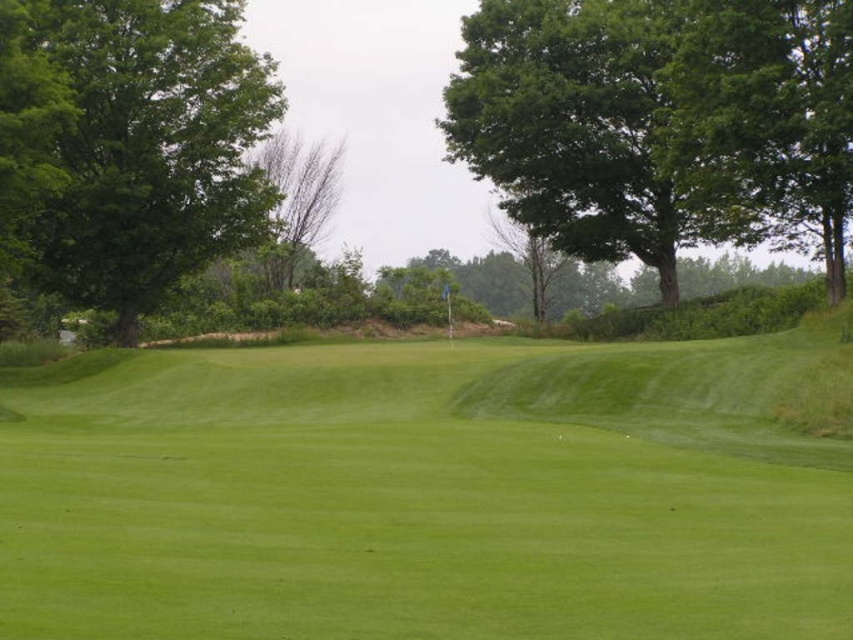
Is green grassy field at center above green leafy tree at left?

Actually, green grassy field at center is below green leafy tree at left.

Between green grassy field at center and green leafy tree at left, which one appears on the left side from the viewer's perspective?

From the viewer's perspective, green leafy tree at left appears more on the left side.

Find the location of a particular element. This screenshot has width=853, height=640. green grassy field at center is located at coordinates (399, 508).

At what (x,y) coordinates should I click in order to perform the action: click on green grassy field at center. Please return your answer as a coordinate pair (x, y). The image size is (853, 640). Looking at the image, I should click on point(399,508).

Which is more to the left, green grassy field at center or green leafy tree at upper right?

From the viewer's perspective, green grassy field at center appears more on the left side.

Between green grassy field at center and green leafy tree at upper right, which one appears on the right side from the viewer's perspective?

green leafy tree at upper right is more to the right.

Is point (364, 589) more distant than point (567, 8)?

No, it is not.

You are a GUI agent. You are given a task and a screenshot of the screen. Output one action in this format:
    pyautogui.click(x=<x>, y=<y>)
    Task: Click on the green grassy field at center
    The height and width of the screenshot is (640, 853).
    Given the screenshot: What is the action you would take?
    pyautogui.click(x=399, y=508)

Locate an element on the screen. green leafy tree at upper right is located at coordinates (660, 124).

Is point (509, 115) farther from camera compared to point (148, 243)?

That is True.

What are the coordinates of `green leafy tree at upper right` in the screenshot? It's located at (660, 124).